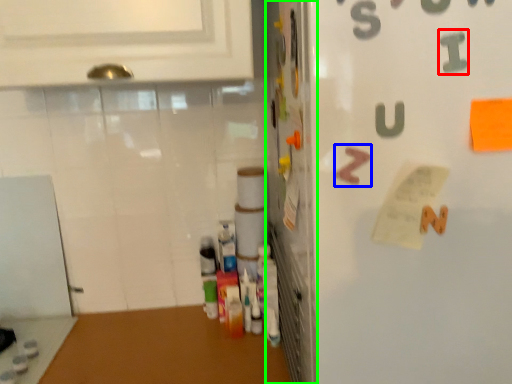
Question: Based on their relative distances, which object is farther from alphabet (highlighted by a red box)? Choose from alphabet (highlighted by a blue box) and door (highlighted by a green box).

Choices:
 (A) alphabet
 (B) door

Answer: (B)